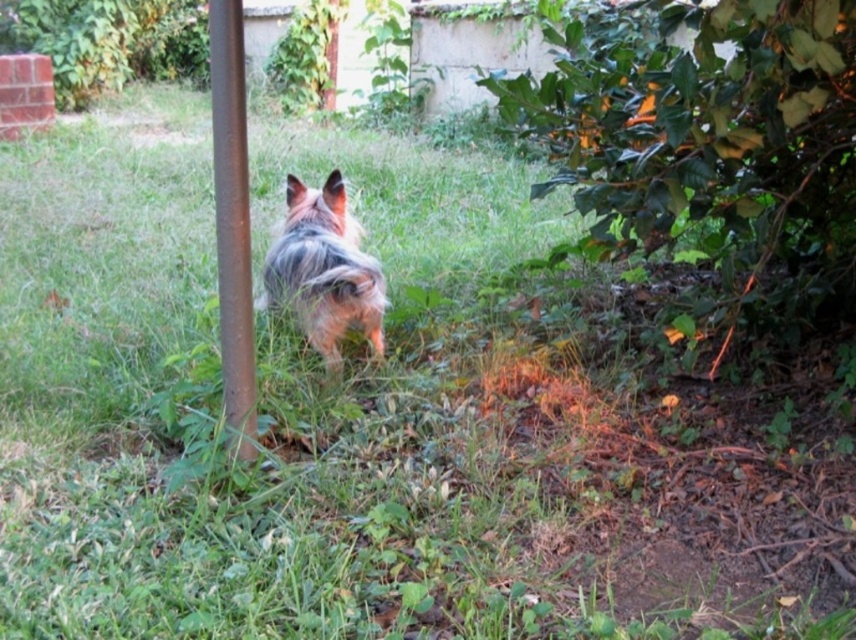
You are standing in the garden and want to place a new flower pot at point (232, 224). However, there is an object already there. What is the object at that point?

The object at point (232, 224) is a rusty metal pole at center left.